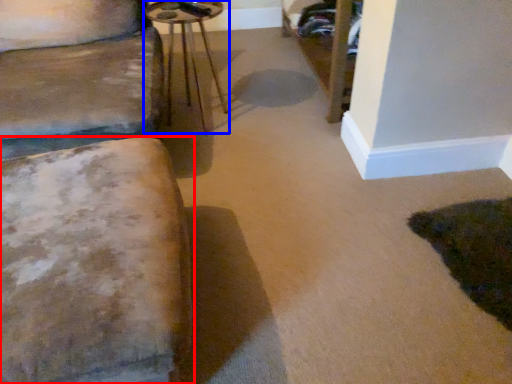
Question: Which point is further to the camera, furniture (highlighted by a red box) or side table (highlighted by a blue box)?

Choices:
 (A) furniture
 (B) side table

Answer: (B)